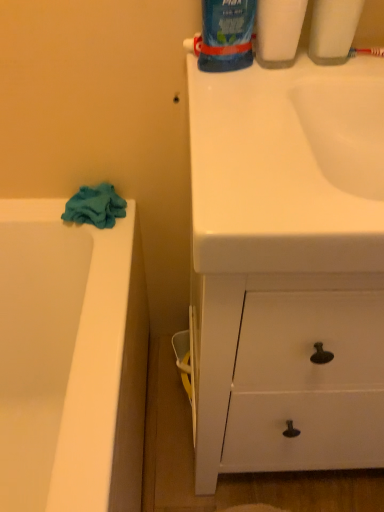
Question: From the image's perspective, is blue glossy toothpaste at upper center, which is the 1th cleaning product from left to right, positioned above or below blue glossy toothpaste tube at upper right, which appears as the third cleaning product when viewed from the left?

Choices:
 (A) above
 (B) below

Answer: (A)

Question: Considering the positions of blue glossy toothpaste at upper center, the 3th cleaning product from the right, and blue glossy toothpaste tube at upper right, which appears as the third cleaning product when viewed from the left, in the image, is blue glossy toothpaste at upper center, the 3th cleaning product from the right, bigger or smaller than blue glossy toothpaste tube at upper right, which appears as the third cleaning product when viewed from the left,?

Choices:
 (A) big
 (B) small

Answer: (A)

Question: Which is nearer to the blue glossy toothpaste at upper center, the 3th cleaning product from the right?

Choices:
 (A) teal fabric towel at left
 (B) red plastic toothbrush at upper right
 (C) blue glossy toothpaste tube at upper right, which is counted as the 1th cleaning product, starting from the right
 (D) blue glossy bottle at upper center, the second cleaning product from the left

Answer: (D)

Question: Considering the real-world distances, which object is closest to the blue glossy toothpaste tube at upper right, which appears as the third cleaning product when viewed from the left?

Choices:
 (A) red plastic toothbrush at upper right
 (B) blue glossy bottle at upper center, placed as the second cleaning product when sorted from right to left
 (C) teal fabric towel at left
 (D) blue glossy toothpaste at upper center, the 3th cleaning product from the right

Answer: (A)